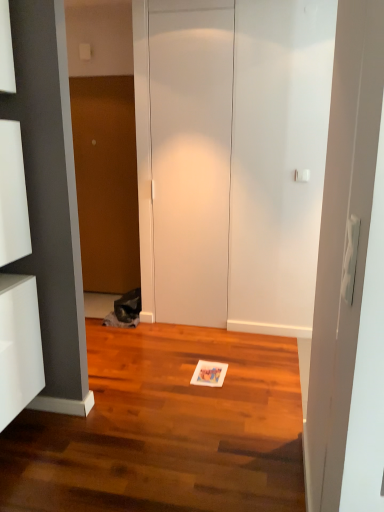
The height and width of the screenshot is (512, 384). Find the location of `vacant space underneath white glossy cabinet at left (from a real-world perspective)`. vacant space underneath white glossy cabinet at left (from a real-world perspective) is located at coordinates (15, 430).